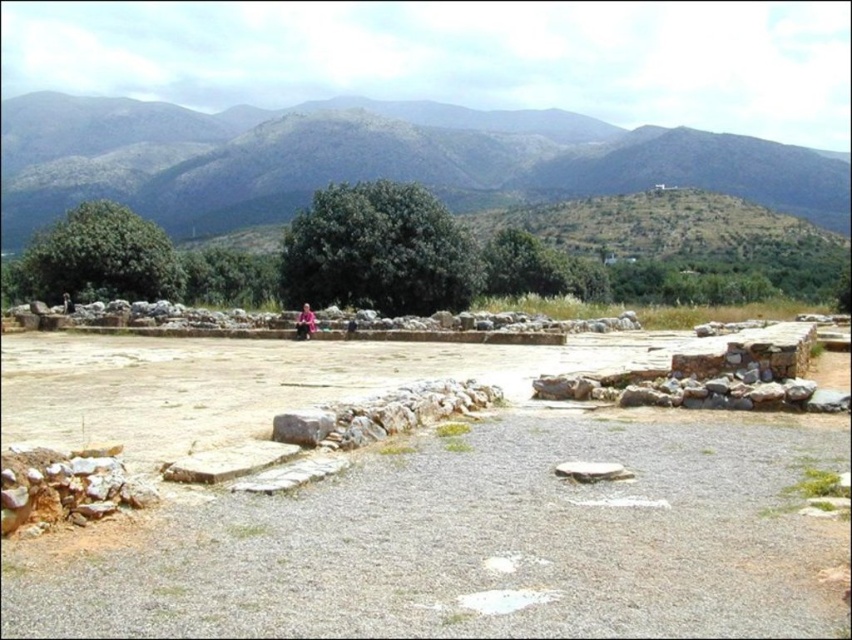
You are an archaeologist standing at the entrance of the site and want to reach the green leafy tree at upper left. Which direction should you move to get closer to it while avoiding the green grassy hill at upper center?

To reach the green leafy tree at upper left, you should move to the left side, as the green grassy hill at upper center is between you and the tree, and it is closer to you than the tree. Moving left would allow you to bypass the hill and approach the tree.

You are standing at the point marked by the coordinates point (370, 157) in the archaeological site. Based on the scene description, what do you see around you?

You are standing on a green grassy hill at upper center, as indicated by the coordinates point (370, 157).

You are a photographer standing at the archaeological site. You want to capture a photo that includes both the point at coordinates point (373, 120) and point (404, 275). Which point should you focus on first to ensure both are in sharp focus?

You should focus on point (404, 275) first because it is closer to the camera than point (373, 120). By focusing on the closer point, the farther point will also be in focus due to the depth of field.